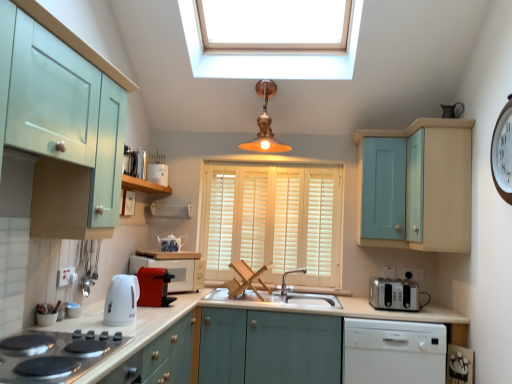
At what (x,y) coordinates should I click in order to perform the action: click on vacant space to the right of silver metallic faucet at center. Please return your answer as a coordinate pair (x, y). The image size is (512, 384). Looking at the image, I should click on (314, 298).